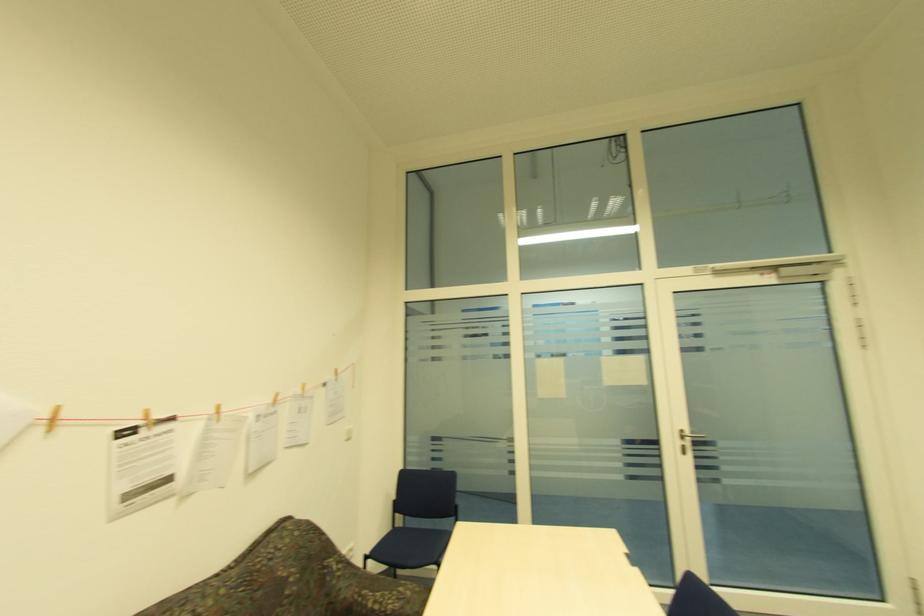
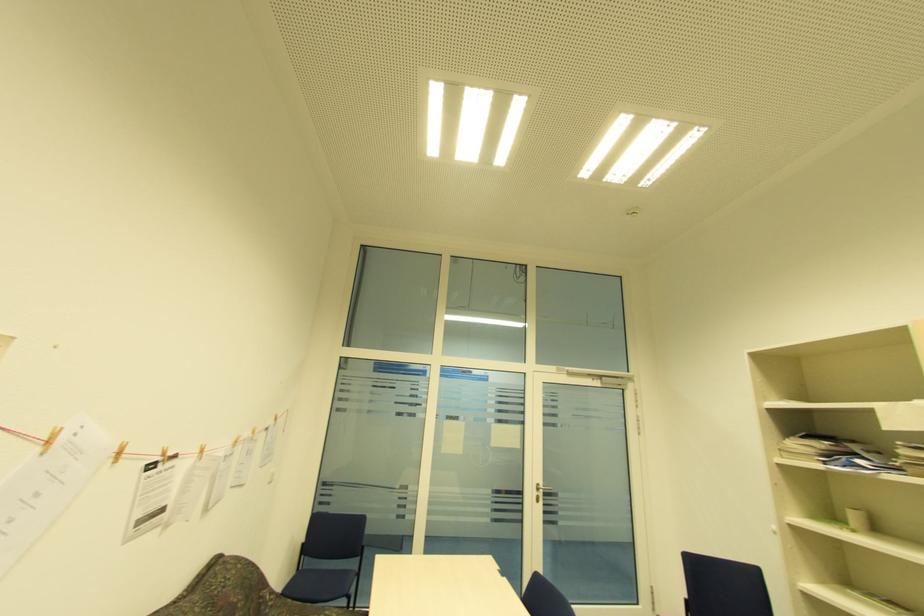
Find the pixel in the second image that matches (682,444) in the first image.

(538, 493)